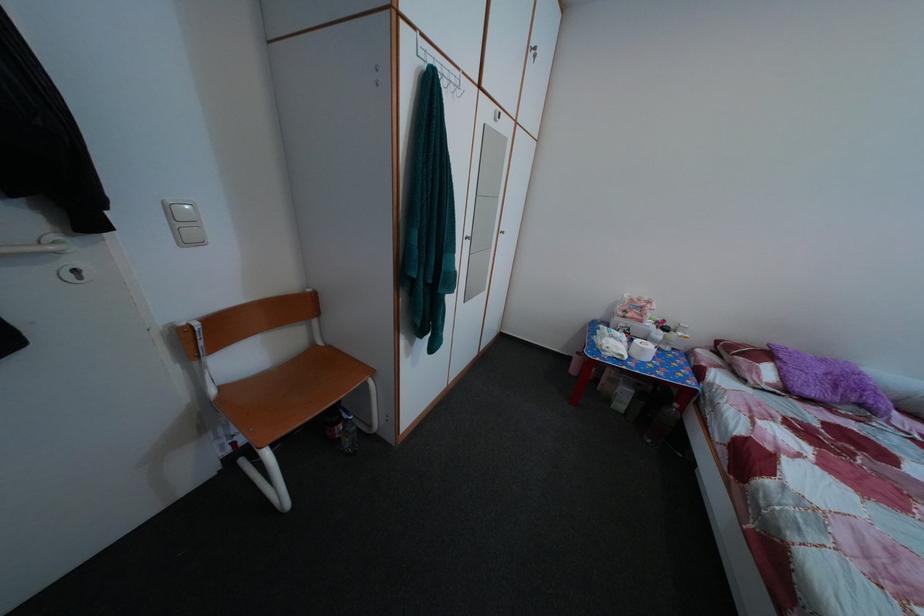
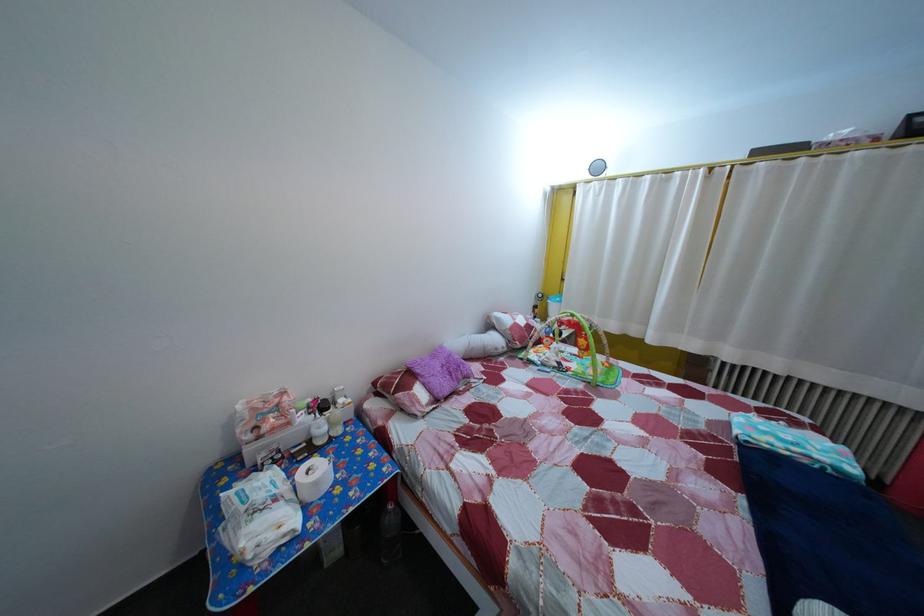
Locate, in the second image, the point that corresponds to [659,331] in the first image.

(311, 427)